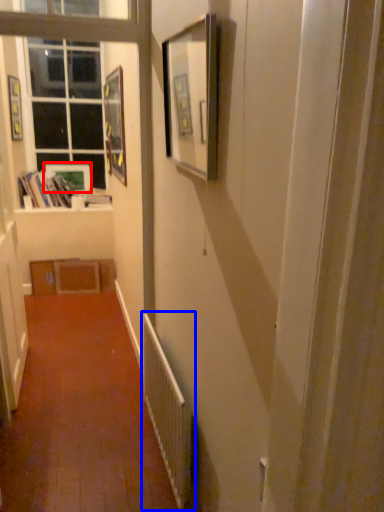
Question: Which of the following is the farthest to the observer, picture frame (highlighted by a red box) or radiator (highlighted by a blue box)?

Choices:
 (A) picture frame
 (B) radiator

Answer: (A)